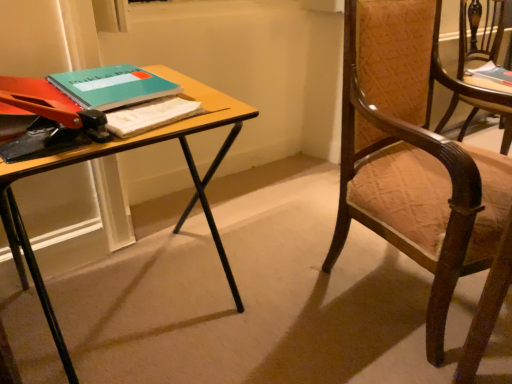
Find the location of a particular element. The image size is (512, 384). vacant space to the right of teal matte notebook at upper left, arranged as the second book when viewed from the right is located at coordinates (196, 103).